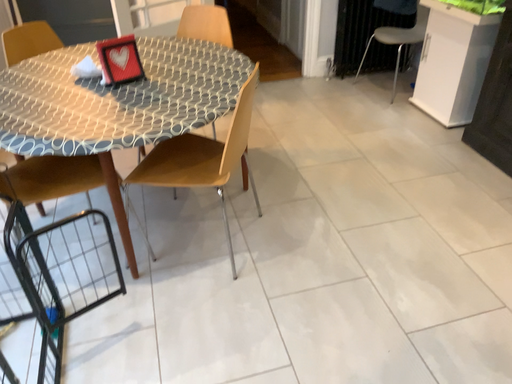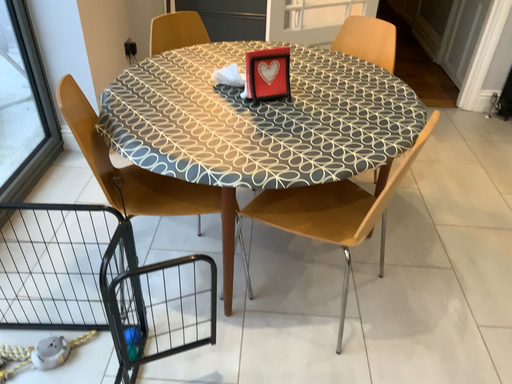
Question: How did the camera likely rotate when shooting the video?

Choices:
 (A) rotated left
 (B) rotated right

Answer: (A)